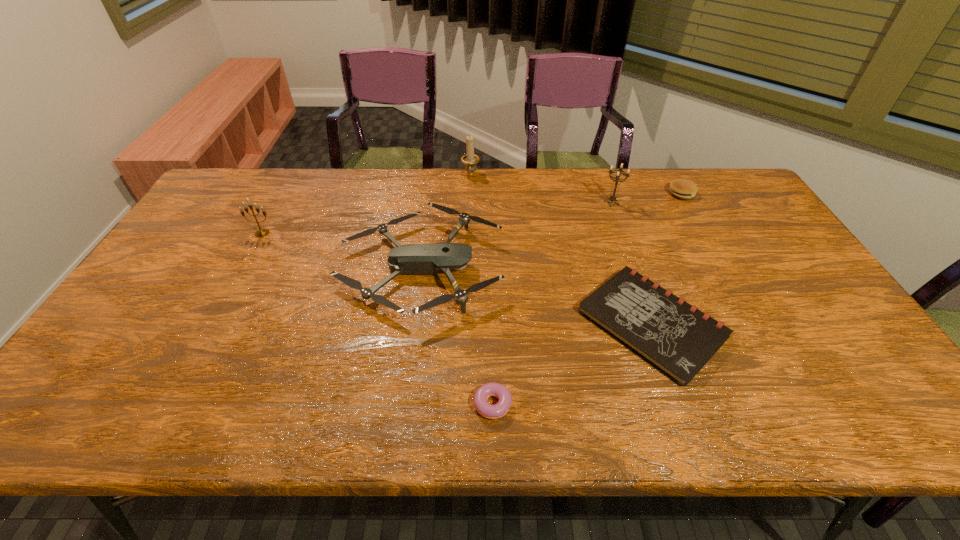
Where is `blank space at the near edge of the desktop`? The height and width of the screenshot is (540, 960). blank space at the near edge of the desktop is located at coordinates (808, 394).

In the image, there is a desktop. In order to click on free region at the left edge in this screenshot , I will do `click(165, 276)`.

Locate an element on the screen. vacant space at the near left corner is located at coordinates (63, 400).

Locate an element on the screen. This screenshot has width=960, height=540. vacant space at the far right corner of the desktop is located at coordinates (716, 185).

In the image, there is a desktop. Identify the location of vacant space at the near right corner. The height and width of the screenshot is (540, 960). (843, 411).

At what (x,y) coordinates should I click in order to perform the action: click on free space between the notebook and the rightmost candelabrum. Please return your answer as a coordinate pair (x, y). This screenshot has height=540, width=960. Looking at the image, I should click on (632, 263).

You are a GUI agent. You are given a task and a screenshot of the screen. Output one action in this format:
    pyautogui.click(x=<x>, y=<y>)
    Task: Click on the free spot between the farthest candelabrum and the patty
    
    Given the screenshot: What is the action you would take?
    pyautogui.click(x=576, y=184)

Where is `vacant space that is in between the leftmost object and the notebook`? The image size is (960, 540). vacant space that is in between the leftmost object and the notebook is located at coordinates (457, 278).

In order to click on free spot between the notebook and the patty in this screenshot , I will do `click(666, 258)`.

Locate an element on the screen. The height and width of the screenshot is (540, 960). free space between the patty and the fourth shortest object is located at coordinates (551, 231).